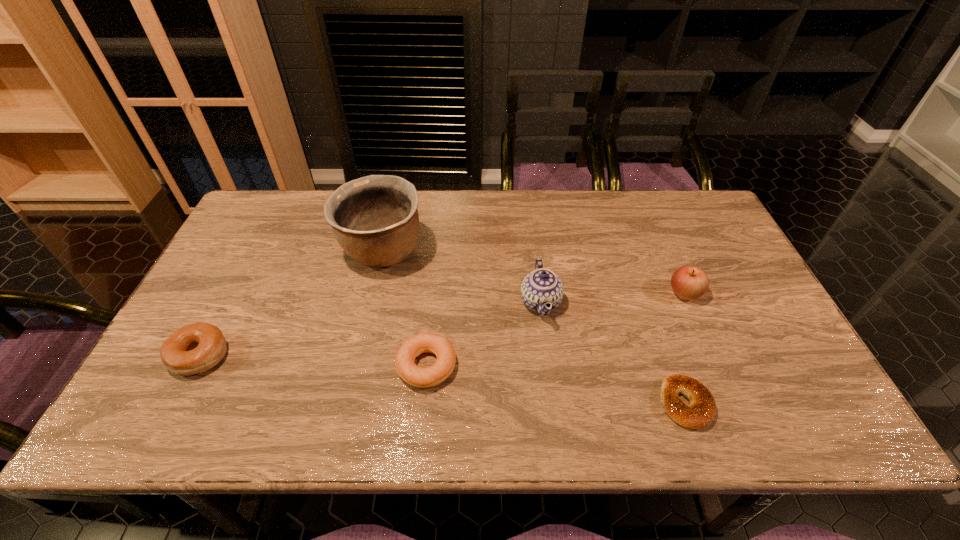
You are a GUI agent. You are given a task and a screenshot of the screen. Output one action in this format:
    pyautogui.click(x=<x>, y=<y>)
    Task: Click on the object located in the left edge section of the desktop
    This screenshot has width=960, height=540.
    Given the screenshot: What is the action you would take?
    pyautogui.click(x=195, y=348)

Locate an element on the screen. object positioned at the right edge is located at coordinates (688, 282).

Locate an element on the screen. The width and height of the screenshot is (960, 540). free space at the far edge of the desktop is located at coordinates click(420, 204).

In the image, there is a desktop. What are the coordinates of `vacant space at the near edge` in the screenshot? It's located at (620, 410).

At what (x,y) coordinates should I click in order to perform the action: click on free space at the left edge. Please return your answer as a coordinate pair (x, y). Image resolution: width=960 pixels, height=540 pixels. Looking at the image, I should click on 238,312.

This screenshot has height=540, width=960. In the image, there is a desktop. In order to click on vacant area at the right edge in this screenshot , I will do `click(765, 341)`.

Find the location of `vacant space at the far left corner of the desktop`. vacant space at the far left corner of the desktop is located at coordinates (294, 190).

Locate an element on the screen. This screenshot has height=540, width=960. vacant space at the near left corner of the desktop is located at coordinates (157, 417).

At what (x,y) coordinates should I click in order to perform the action: click on vacant space at the far right corner of the desktop. Please return your answer as a coordinate pair (x, y). The image size is (960, 540). Looking at the image, I should click on (x=681, y=191).

The height and width of the screenshot is (540, 960). What are the coordinates of `empty space between the second bagel from left to right and the chinaware` in the screenshot? It's located at (484, 334).